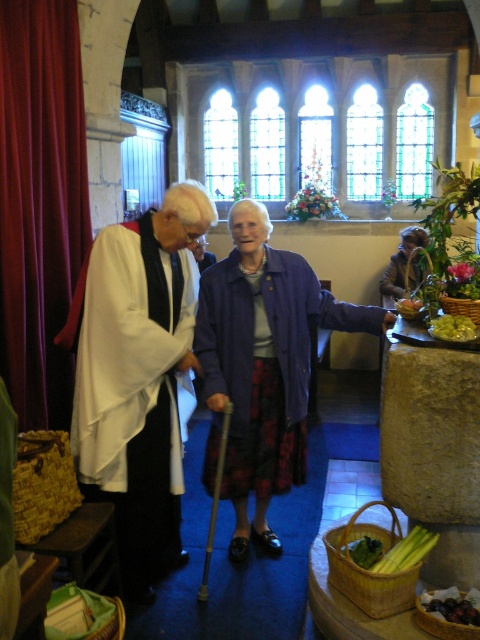
Is the position of velvet deep red curtain at left more distant than that of velvet brown coat at center?

No, it is not.

Does velvet deep red curtain at left appear on the left side of velvet brown coat at center?

Yes, velvet deep red curtain at left is to the left of velvet brown coat at center.

Is point (71, 97) positioned behind point (417, 227)?

No, (71, 97) is closer to viewer.

Locate an element on the screen. velvet deep red curtain at left is located at coordinates (39, 204).

Is white matte vestment at center behind velvet brown coat at center?

No, white matte vestment at center is closer to the viewer.

Is point (175, 506) farther from viewer compared to point (422, 232)?

No, it is not.

The width and height of the screenshot is (480, 640). Find the location of `white matte vestment at center`. white matte vestment at center is located at coordinates (136, 376).

Can you confirm if white clothed figure at left is smaller than velvet brown coat at center?

Incorrect, white clothed figure at left is not smaller in size than velvet brown coat at center.

Describe the element at coordinates (137, 376) in the screenshot. This screenshot has height=640, width=480. I see `white clothed figure at left` at that location.

The image size is (480, 640). What are the coordinates of `white clothed figure at left` in the screenshot? It's located at (137, 376).